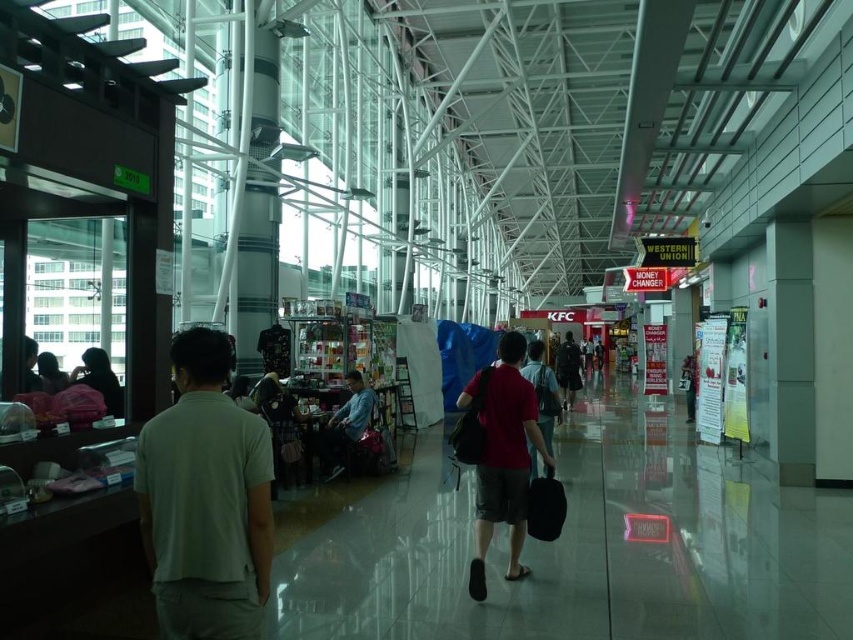
Question: Can you confirm if denim jacket at center is bigger than dark red shirt at center?

Choices:
 (A) yes
 (B) no

Answer: (B)

Question: Which object is the closest to the dark red shirt at center?

Choices:
 (A) light green cotton polo shirt at left
 (B) denim jacket at center

Answer: (B)

Question: Which point appears closest to the camera in this image?

Choices:
 (A) (204, 561)
 (B) (518, 339)
 (C) (323, 432)
 (D) (573, 372)

Answer: (A)

Question: Can you confirm if light green cotton polo shirt at left is bigger than matte red shirt at center?

Choices:
 (A) no
 (B) yes

Answer: (A)

Question: Among these points, which one is nearest to the camera?

Choices:
 (A) (514, 477)
 (B) (563, 346)
 (C) (341, 445)
 (D) (223, 460)

Answer: (D)

Question: Can you confirm if light green cotton polo shirt at left is positioned to the left of denim jacket at center?

Choices:
 (A) no
 (B) yes

Answer: (A)